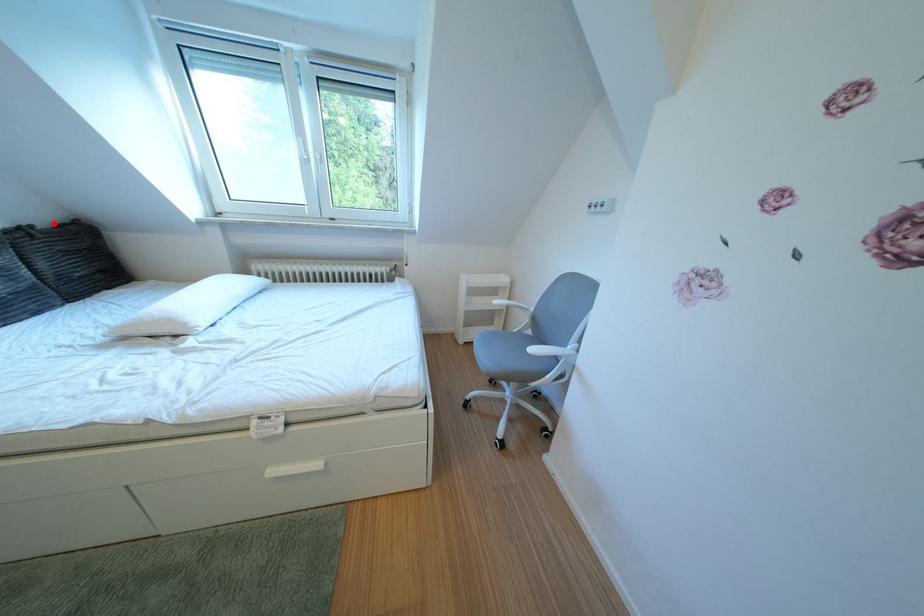
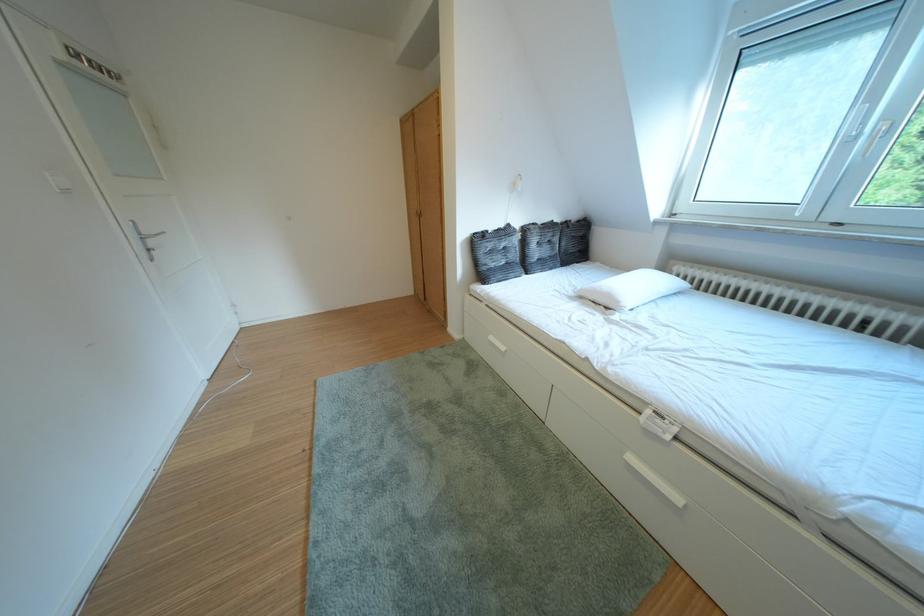
Question: I am providing you with two images of the same scene from different viewpoints. A red point is shown in image1. For the corresponding object point in image2, is it positioned nearer or farther from the camera?

Choices:
 (A) Nearer
 (B) Farther

Answer: (A)